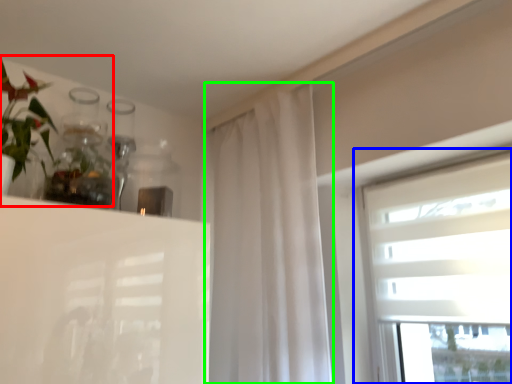
Question: Which is farther away from floral arrangement (highlighted by a red box)? window (highlighted by a blue box) or curtain (highlighted by a green box)?

Choices:
 (A) window
 (B) curtain

Answer: (A)